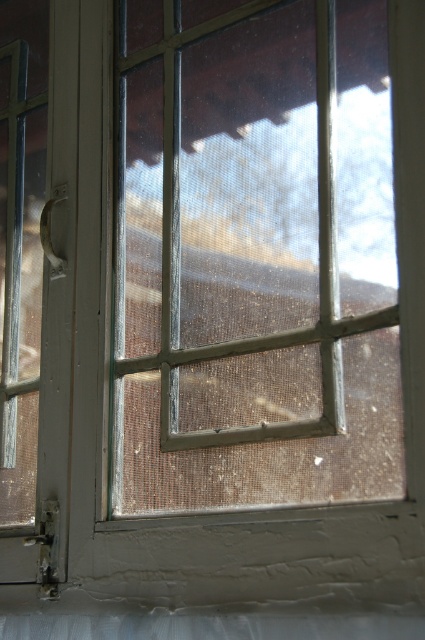
Is clear glass window at center to the right of white textured curtain at bottom from the viewer's perspective?

Correct, you'll find clear glass window at center to the right of white textured curtain at bottom.

Between clear glass window at center and white textured curtain at bottom, which one is positioned lower?

white textured curtain at bottom

Does point (170, 136) come in front of point (206, 627)?

No.

In order to click on clear glass window at center in this screenshot , I will do `click(254, 257)`.